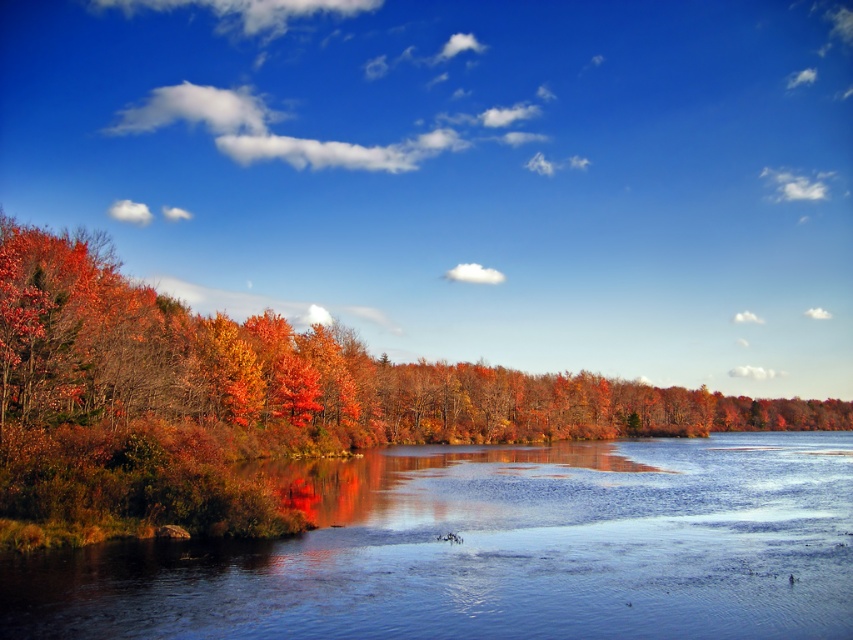
Looking at this image, you are planning to place a small wooden boat in the scene. The boat requires a space wider than the smooth reflective water at center to float. Can you determine if the autumn leaves at left area has enough width for the boat?

The smooth reflective water at center is narrower than autumn leaves at left, so the autumn leaves at left area has sufficient width to accommodate the boat.

You are standing on a wooden bridge that crosses over the smooth reflective water at center. You want to toss a pebble into the water so it lands near the autumn leaves at left. Which direction should you aim to hit the target?

The smooth reflective water at center is above autumn leaves at left, so you should aim towards the autumn leaves at left to hit the target.